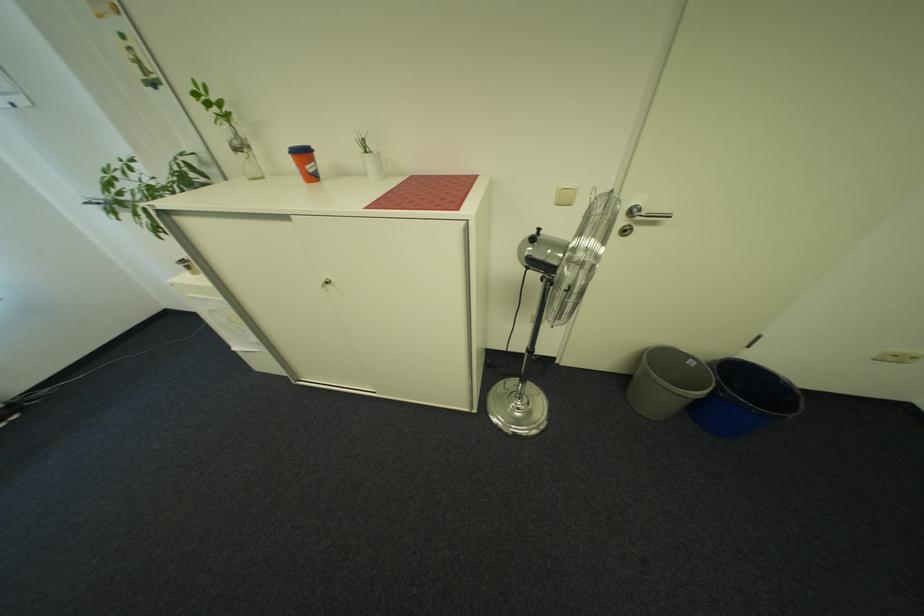
The location [744,399] corresponds to which object?

It refers to a blue bucket.